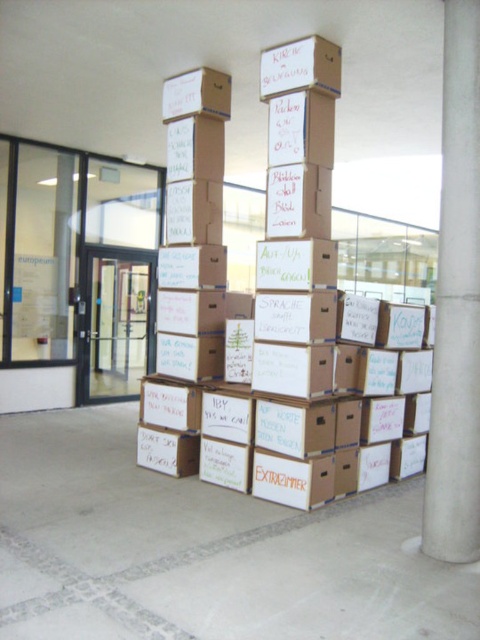
Question: Is white concrete pillar at center smaller than matte cardboard box at upper center?

Choices:
 (A) yes
 (B) no

Answer: (B)

Question: In this image, where is brown cardboard box at center located relative to white concrete pillar at center?

Choices:
 (A) above
 (B) below

Answer: (B)

Question: Which object is closer to the camera taking this photo?

Choices:
 (A) white concrete pillar at center
 (B) brown cardboard box at center

Answer: (A)

Question: Considering the relative positions of brown cardboard box at center and white concrete pillar at center in the image provided, where is brown cardboard box at center located with respect to white concrete pillar at center?

Choices:
 (A) below
 (B) above

Answer: (A)

Question: Among these points, which one is farthest from the camera?

Choices:
 (A) (228, 116)
 (B) (419, 346)
 (C) (441, 349)

Answer: (B)

Question: Which point is closer to the camera?

Choices:
 (A) (205, 84)
 (B) (464, 228)

Answer: (B)